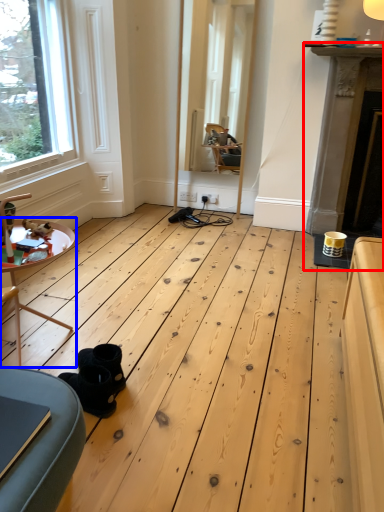
Question: Which object appears closest to the camera in this image, fireplace (highlighted by a red box) or table (highlighted by a blue box)?

Choices:
 (A) fireplace
 (B) table

Answer: (B)